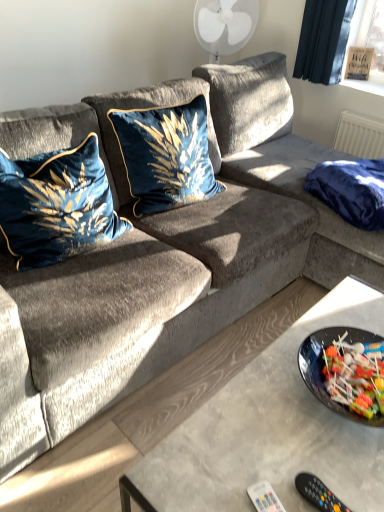
Question: In which direction should I rotate to look at velvet blue pillow at center, which ranks as the 1th pillow in right-to-left order?

Choices:
 (A) right
 (B) left

Answer: (B)

Question: Is velvet blue pillow at left, arranged as the second pillow when viewed from the right, not inside velvet blue pillow at center, which ranks as the 1th pillow in right-to-left order?

Choices:
 (A) yes
 (B) no

Answer: (A)

Question: Is velvet blue pillow at left, placed as the first pillow when sorted from left to right, positioned behind velvet blue pillow at center, which ranks as the 1th pillow in right-to-left order?

Choices:
 (A) yes
 (B) no

Answer: (B)

Question: Considering the relative sizes of velvet blue pillow at left, arranged as the second pillow when viewed from the right, and velvet blue pillow at center, which ranks as the 1th pillow in right-to-left order, in the image provided, is velvet blue pillow at left, arranged as the second pillow when viewed from the right, taller than velvet blue pillow at center, which ranks as the 1th pillow in right-to-left order,?

Choices:
 (A) yes
 (B) no

Answer: (B)

Question: Would you say velvet blue pillow at left, arranged as the second pillow when viewed from the right, contains velvet blue pillow at center, which ranks as the 1th pillow in right-to-left order?

Choices:
 (A) yes
 (B) no

Answer: (B)

Question: From the image's perspective, is velvet blue pillow at left, placed as the first pillow when sorted from left to right, located above velvet blue pillow at center, which ranks as the 1th pillow in right-to-left order?

Choices:
 (A) no
 (B) yes

Answer: (A)

Question: Considering the relative sizes of velvet blue pillow at left, placed as the first pillow when sorted from left to right, and velvet blue pillow at center, which ranks as the 1th pillow in right-to-left order, in the image provided, is velvet blue pillow at left, placed as the first pillow when sorted from left to right, bigger than velvet blue pillow at center, which ranks as the 1th pillow in right-to-left order,?

Choices:
 (A) no
 (B) yes

Answer: (B)

Question: Is velvet blue pillow at center, which ranks as the 1th pillow in right-to-left order, not close to white plastic remote at lower center?

Choices:
 (A) yes
 (B) no

Answer: (A)

Question: Are velvet blue pillow at center, the second pillow positioned from the left, and white plastic remote at lower center making contact?

Choices:
 (A) yes
 (B) no

Answer: (B)

Question: Can you confirm if velvet blue pillow at center, which ranks as the 1th pillow in right-to-left order, is taller than white plastic remote at lower center?

Choices:
 (A) yes
 (B) no

Answer: (A)

Question: Is velvet blue pillow at center, which ranks as the 1th pillow in right-to-left order, thinner than white plastic remote at lower center?

Choices:
 (A) no
 (B) yes

Answer: (A)

Question: Can you confirm if velvet blue pillow at center, which ranks as the 1th pillow in right-to-left order, is positioned to the left of white plastic remote at lower center?

Choices:
 (A) no
 (B) yes

Answer: (B)

Question: Can you confirm if velvet blue pillow at center, which ranks as the 1th pillow in right-to-left order, is bigger than white plastic remote at lower center?

Choices:
 (A) yes
 (B) no

Answer: (A)

Question: Can we say white plastic remote at lower center lies outside velvet blue pillow at center, the second pillow positioned from the left?

Choices:
 (A) no
 (B) yes

Answer: (B)